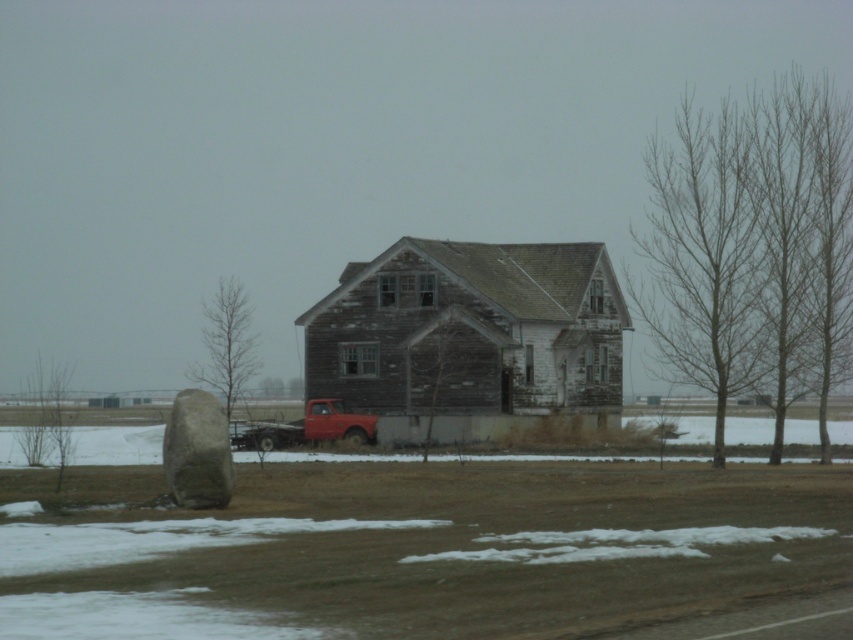
Question: Among these objects, which one is farthest from the camera?

Choices:
 (A) smooth gray rock at lower left
 (B) matte red truck at center
 (C) weathered wood barn at center

Answer: (B)

Question: Which object is positioned closest to the smooth gray rock at lower left?

Choices:
 (A) matte red truck at center
 (B) weathered wood barn at center

Answer: (A)

Question: Which point is closer to the camera?

Choices:
 (A) (218, 436)
 (B) (241, 442)
 (C) (602, 323)

Answer: (A)

Question: Is smooth gray rock at lower left smaller than matte red truck at center?

Choices:
 (A) no
 (B) yes

Answer: (A)

Question: Is weathered wood barn at center smaller than matte red truck at center?

Choices:
 (A) yes
 (B) no

Answer: (B)

Question: Can you confirm if weathered wood barn at center is bigger than matte red truck at center?

Choices:
 (A) no
 (B) yes

Answer: (B)